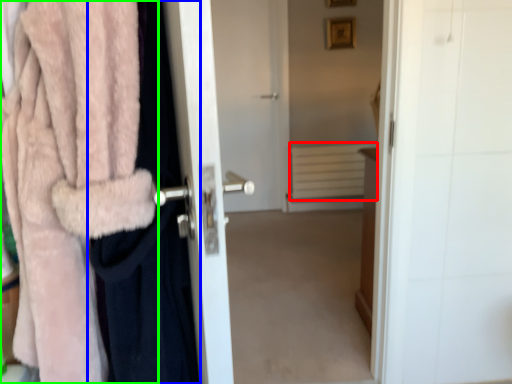
Question: Which is farther away from radiator (highlighted by a red box)? clothing (highlighted by a blue box) or towel (highlighted by a green box)?

Choices:
 (A) clothing
 (B) towel

Answer: (B)